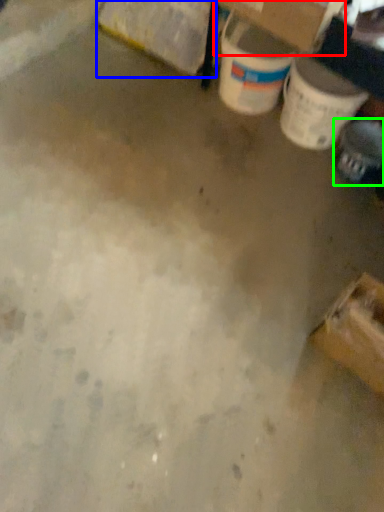
Question: Considering the real-world distances, which object is closest to cardboard box (highlighted by a red box)? cardboard box (highlighted by a blue box) or footwear (highlighted by a green box).

Choices:
 (A) cardboard box
 (B) footwear

Answer: (A)